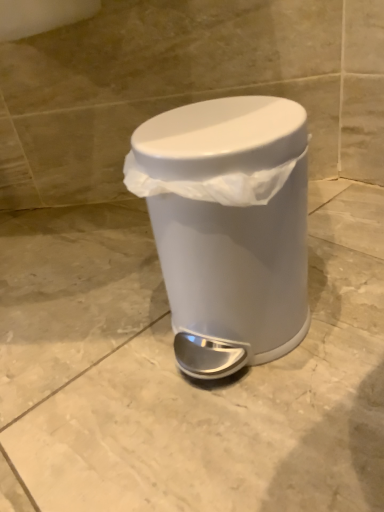
This screenshot has height=512, width=384. I want to click on vacant region in front of white plastic waste container at center, so click(x=243, y=439).